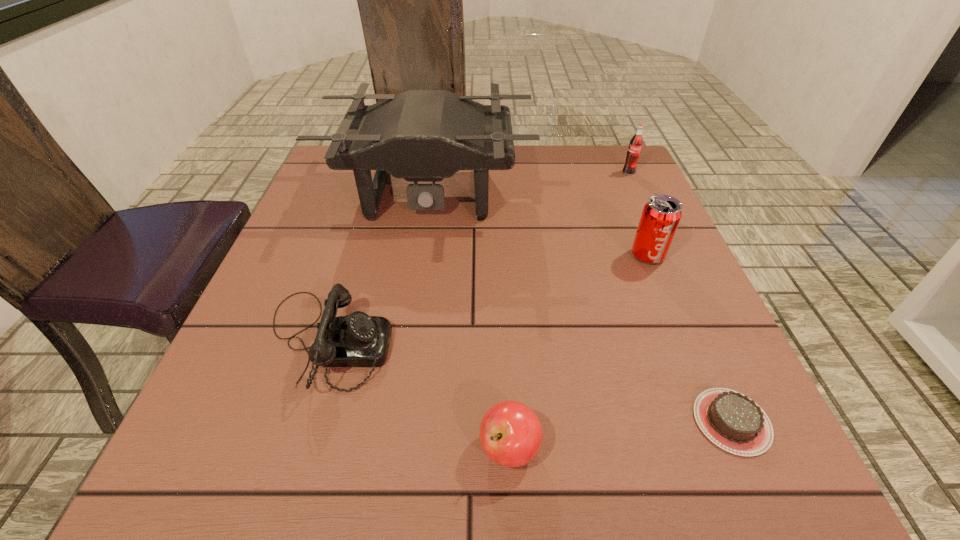
What are the coordinates of `free space that satisfies the following two spatial constraints: 1. on the back side of the apple; 2. on the right side of the third farthest object` in the screenshot? It's located at (500, 255).

This screenshot has width=960, height=540. Identify the location of vacant position in the image that satisfies the following two spatial constraints: 1. on the back side of the apple; 2. on the front-facing side of the telephone. (504, 342).

Locate an element on the screen. free spot that satisfies the following two spatial constraints: 1. on the front-facing side of the telephone; 2. on the back side of the apple is located at coordinates (293, 448).

Locate an element on the screen. This screenshot has height=540, width=960. free space that satisfies the following two spatial constraints: 1. with a camera mounted on the underside of the drone; 2. on the front-facing side of the telephone is located at coordinates (409, 342).